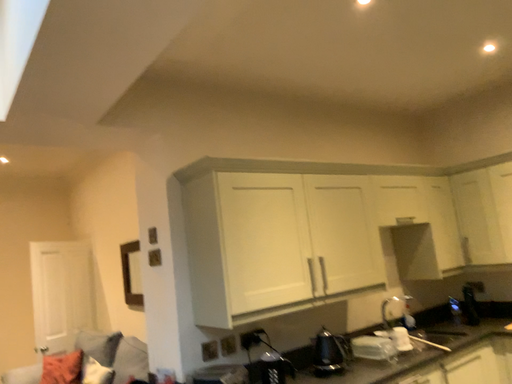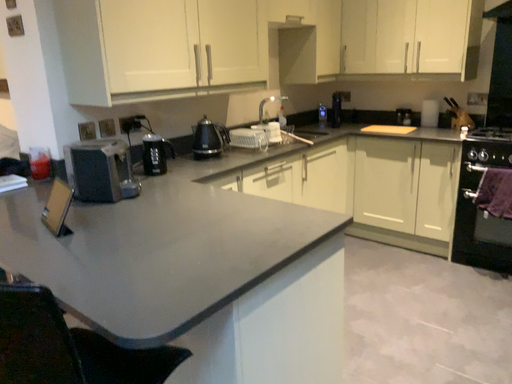
Question: How did the camera likely rotate when shooting the video?

Choices:
 (A) rotated right
 (B) rotated left

Answer: (A)